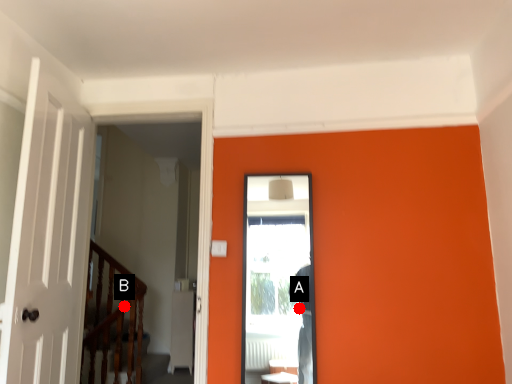
Question: Two points are circled on the image, labeled by A and B beside each circle. Among these points, which one is farthest from the camera?

Choices:
 (A) A is further
 (B) B is further

Answer: (B)